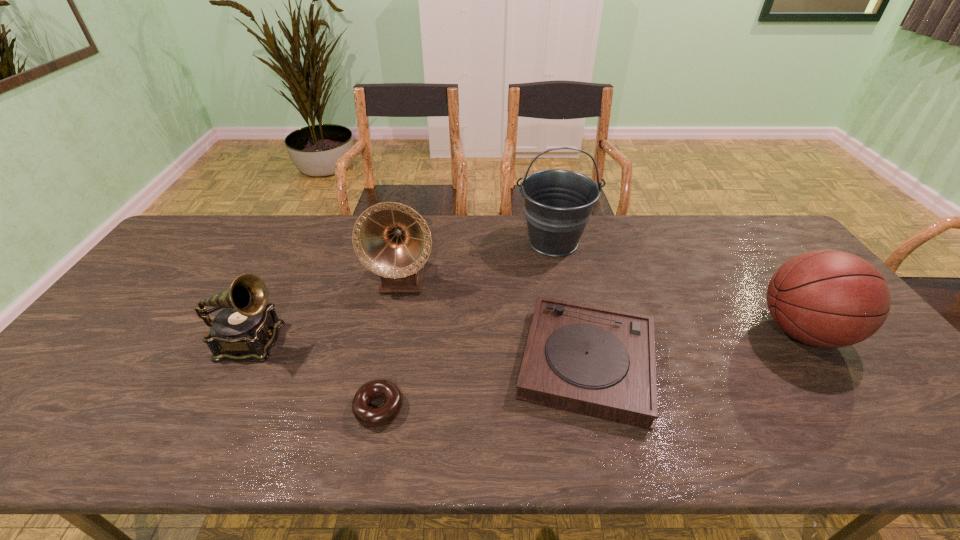
Find the location of a particular element. This screenshot has height=540, width=960. free space located on the horn of the second tallest phonograph record is located at coordinates (430, 342).

Where is `vacant space located on the front of the rightmost object`? vacant space located on the front of the rightmost object is located at coordinates (885, 445).

Identify the location of free spot located on the right of the rightmost phonograph record. This screenshot has width=960, height=540. (754, 362).

Identify the location of vacant space located 0.260m on the left of the doughnut. The height and width of the screenshot is (540, 960). (241, 407).

Where is `object that is at the far edge`? object that is at the far edge is located at coordinates (558, 203).

Image resolution: width=960 pixels, height=540 pixels. What are the coordinates of `phonograph record at the near edge` in the screenshot? It's located at (600, 362).

Where is `doughnut positioned at the near edge`? The image size is (960, 540). doughnut positioned at the near edge is located at coordinates (372, 417).

Find the location of a particular element. object positioned at the right edge is located at coordinates (827, 298).

Where is `free point at the far edge`? Image resolution: width=960 pixels, height=540 pixels. free point at the far edge is located at coordinates (685, 219).

Image resolution: width=960 pixels, height=540 pixels. Identify the location of vacant space at the near edge of the desktop. tap(332, 443).